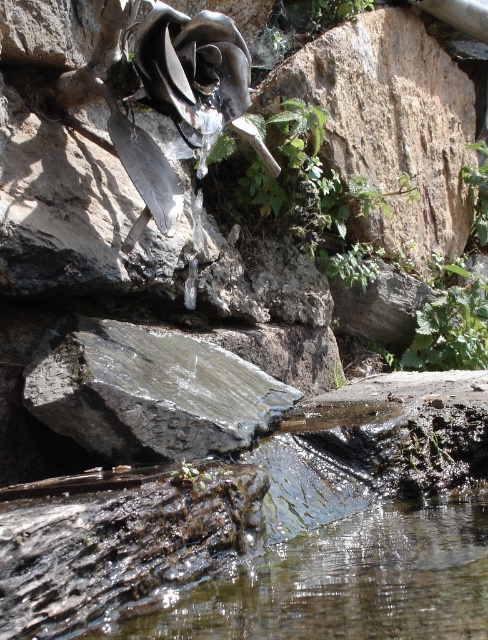
You are standing in front of the scene and want to reach both the clear water at lower center and the rough stone wall at upper right. Which object will you encounter first as you move forward?

The clear water at lower center is closer to the viewer than the rough stone wall at upper right, so you will encounter the clear water at lower center first.

You are standing at the edge of a stream and see the clear water at lower center and the gray rough rock at center. Which one is wider in terms of visual width in the image?

The clear water at lower center is wider than the gray rough rock at center in the image.